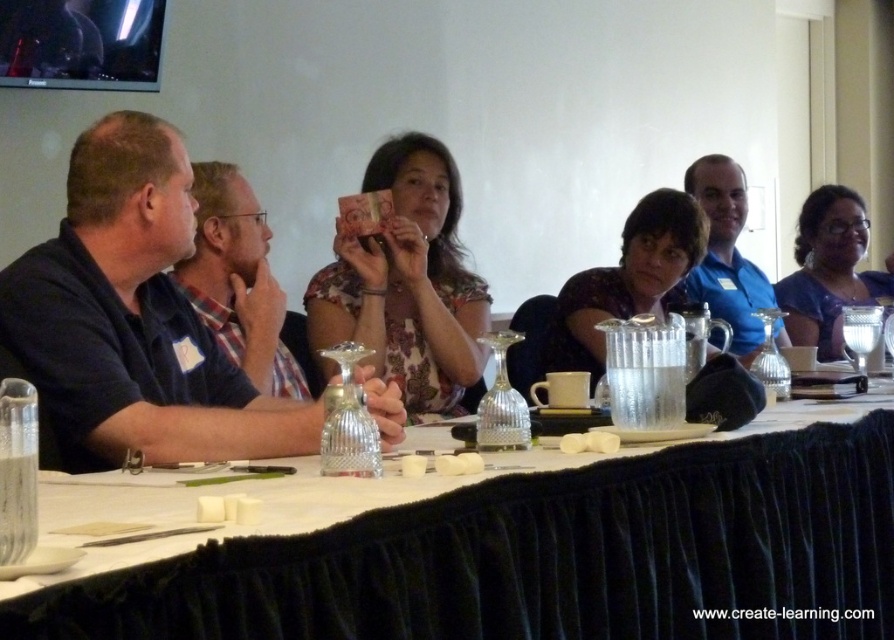
Between blue plaid shirt at left and translucent glass pitcher at center, which one has less height?

translucent glass pitcher at center

Does blue plaid shirt at left appear on the left side of translucent glass pitcher at center?

Correct, you'll find blue plaid shirt at left to the left of translucent glass pitcher at center.

Is point (224, 320) positioned before point (634, 268)?

That is True.

At what (x,y) coordinates should I click in order to perform the action: click on blue plaid shirt at left. Please return your answer as a coordinate pair (x, y). The width and height of the screenshot is (894, 640). Looking at the image, I should click on (238, 280).

Is blue plaid shirt at left taller than blue satin dress at right?

Incorrect, blue plaid shirt at left's height is not larger of blue satin dress at right's.

Who is more forward, (262, 372) or (867, 289)?

Point (262, 372)

The width and height of the screenshot is (894, 640). Identify the location of blue plaid shirt at left. (238, 280).

Does floral fabric shirt at center have a larger size compared to translucent glass pitcher at center?

Indeed, floral fabric shirt at center has a larger size compared to translucent glass pitcher at center.

What do you see at coordinates (407, 282) in the screenshot?
I see `floral fabric shirt at center` at bounding box center [407, 282].

Is point (395, 262) less distant than point (707, 236)?

Yes, it is in front of point (707, 236).

In order to click on floral fabric shirt at center in this screenshot , I will do `click(407, 282)`.